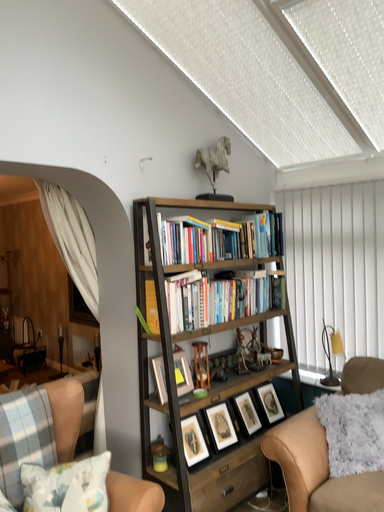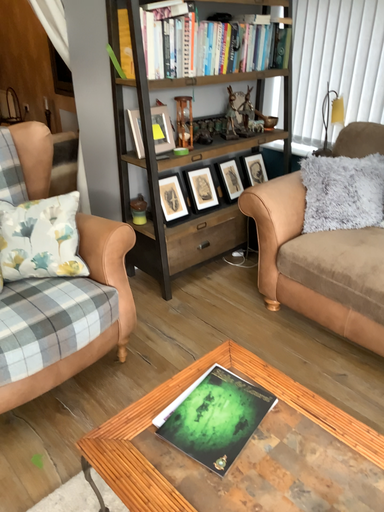
Question: Which way did the camera rotate in the video?

Choices:
 (A) rotated upward
 (B) rotated downward

Answer: (B)